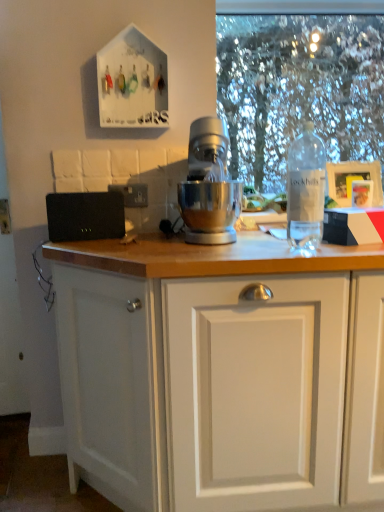
Question: Can you confirm if clear plastic bottle at right is smaller than black plastic electric outlet at upper left?

Choices:
 (A) yes
 (B) no

Answer: (B)

Question: Is clear plastic bottle at right to the left of black plastic electric outlet at upper left from the viewer's perspective?

Choices:
 (A) no
 (B) yes

Answer: (A)

Question: Does clear plastic bottle at right have a greater height compared to black plastic electric outlet at upper left?

Choices:
 (A) yes
 (B) no

Answer: (A)

Question: From a real-world perspective, is clear plastic bottle at right located higher than black plastic electric outlet at upper left?

Choices:
 (A) yes
 (B) no

Answer: (A)

Question: Is clear plastic bottle at right touching black plastic electric outlet at upper left?

Choices:
 (A) no
 (B) yes

Answer: (A)

Question: From the image's perspective, is clear plastic bottle at right above or below clear plastic bottle at right?

Choices:
 (A) below
 (B) above

Answer: (B)

Question: Is clear plastic bottle at right bigger or smaller than clear plastic bottle at right?

Choices:
 (A) small
 (B) big

Answer: (B)

Question: In the image, is clear plastic bottle at right on the left side or the right side of clear plastic bottle at right?

Choices:
 (A) right
 (B) left

Answer: (A)

Question: Is clear plastic bottle at right spatially inside clear plastic bottle at right, or outside of it?

Choices:
 (A) inside
 (B) outside

Answer: (B)

Question: From a real-world perspective, is clear plastic bottle at right physically located above or below black plastic electric outlet at upper left?

Choices:
 (A) below
 (B) above

Answer: (B)

Question: Considering the positions of clear plastic bottle at right and black plastic electric outlet at upper left in the image, is clear plastic bottle at right wider or thinner than black plastic electric outlet at upper left?

Choices:
 (A) wide
 (B) thin

Answer: (A)

Question: Considering the positions of point (284, 103) and point (135, 202), is point (284, 103) closer or farther from the camera than point (135, 202)?

Choices:
 (A) farther
 (B) closer

Answer: (A)

Question: Is clear plastic bottle at right taller or shorter than black plastic electric outlet at upper left?

Choices:
 (A) short
 (B) tall

Answer: (B)

Question: From their relative heights in the image, would you say black plastic electric outlet at upper left is taller or shorter than clear plastic bottle at right?

Choices:
 (A) tall
 (B) short

Answer: (B)

Question: Is black plastic electric outlet at upper left in front of or behind clear plastic bottle at right in the image?

Choices:
 (A) behind
 (B) front

Answer: (B)